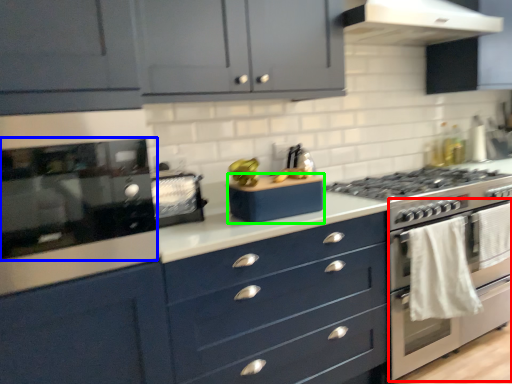
Question: Which object is positioned farthest from oven (highlighted by a red box)? Select from kitchen appliance (highlighted by a blue box) and appliance (highlighted by a green box).

Choices:
 (A) kitchen appliance
 (B) appliance

Answer: (A)